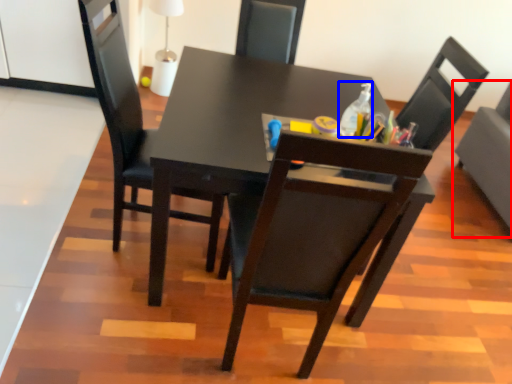
Question: Among these objects, which one is nearest to the camera, chair (highlighted by a red box) or bottle (highlighted by a blue box)?

Choices:
 (A) chair
 (B) bottle

Answer: (B)